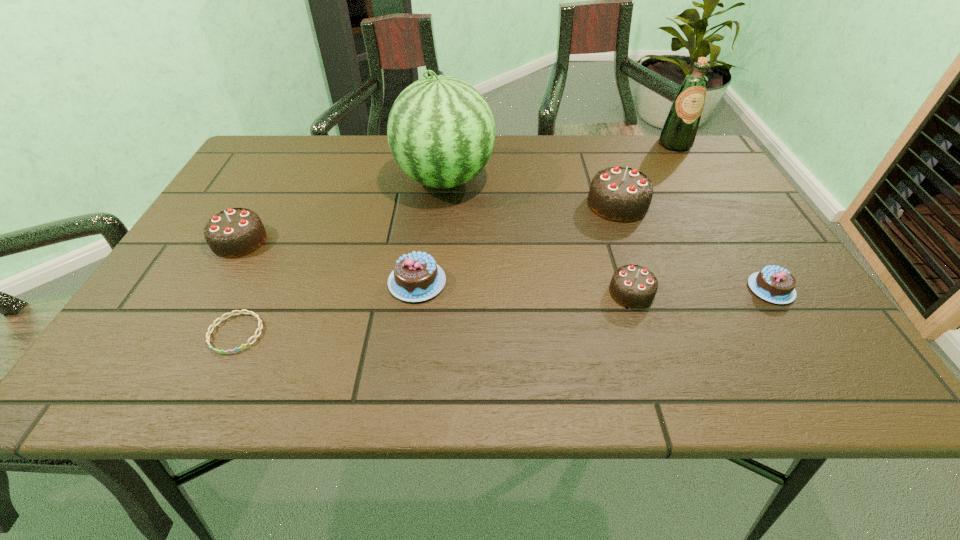
Identify the location of the smallest chocolate chocolate cake. The width and height of the screenshot is (960, 540). (634, 286).

You are a GUI agent. You are given a task and a screenshot of the screen. Output one action in this format:
    pyautogui.click(x=<x>, y=<y>)
    Task: Click on the second shortest object
    The width and height of the screenshot is (960, 540).
    Given the screenshot: What is the action you would take?
    pyautogui.click(x=774, y=284)

The width and height of the screenshot is (960, 540). What are the coordinates of `the smaller pink chocolate cake` in the screenshot? It's located at (774, 284).

You are a GUI agent. You are given a task and a screenshot of the screen. Output one action in this format:
    pyautogui.click(x=<x>, y=<y>)
    Task: Click on the bracelet
    This screenshot has height=540, width=960.
    Given the screenshot: What is the action you would take?
    pyautogui.click(x=213, y=325)

I want to click on the nearest object, so point(213,325).

Find the location of a particular element. This screenshot has width=960, height=540. vacant space situated 0.050m on the back of the tallest object is located at coordinates (448, 145).

Find the location of a particular element. free point located on the front-facing side of the olive oil is located at coordinates (731, 237).

Where is `vacant region located 0.090m on the back of the biggest chocolate chocolate cake`? The width and height of the screenshot is (960, 540). vacant region located 0.090m on the back of the biggest chocolate chocolate cake is located at coordinates (605, 168).

Identify the location of free space located on the back of the fourth tallest object. The width and height of the screenshot is (960, 540). (265, 197).

At what (x,y) coordinates should I click in order to perform the action: click on vacant space located on the left of the second chocolate cake from left to right. Please return your answer as a coordinate pair (x, y). The height and width of the screenshot is (540, 960). Looking at the image, I should click on (359, 282).